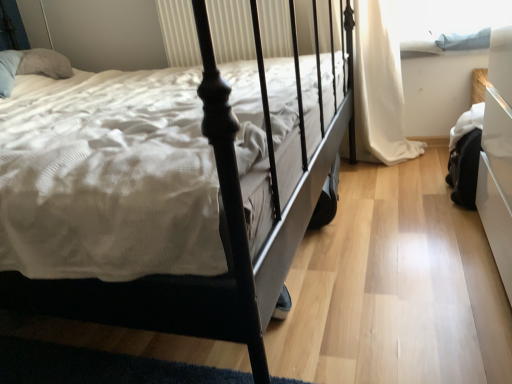
At what (x,y) coordinates should I click in order to perform the action: click on free space in front of white fabric curtain at right. Please return your answer as a coordinate pair (x, y). Looking at the image, I should click on (396, 178).